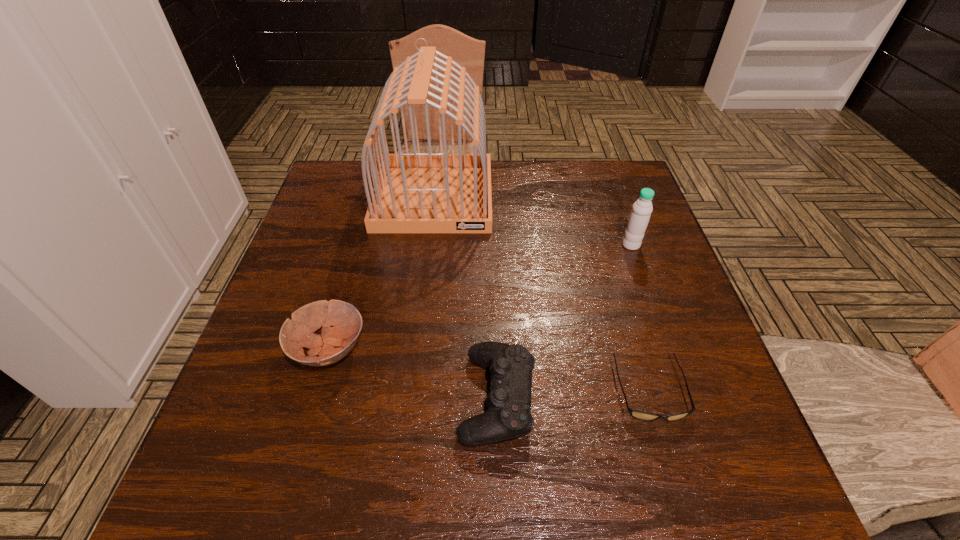
Locate an element on the screen. This screenshot has height=540, width=960. the tallest object is located at coordinates (414, 192).

The width and height of the screenshot is (960, 540). I want to click on birdcage, so click(414, 192).

What are the coordinates of `water bottle` in the screenshot? It's located at (639, 217).

Locate an element on the screen. the fourth shortest object is located at coordinates (639, 217).

You are a GUI agent. You are given a task and a screenshot of the screen. Output one action in this format:
    pyautogui.click(x=<x>, y=<y>)
    Task: Click on the control
    
    Given the screenshot: What is the action you would take?
    pyautogui.click(x=508, y=416)

At what (x,y) coordinates should I click in order to perform the action: click on bowl. Please return your answer as a coordinate pair (x, y). This screenshot has width=960, height=540. Looking at the image, I should click on (334, 343).

The height and width of the screenshot is (540, 960). In order to click on sunglasses in this screenshot , I will do `click(641, 415)`.

Image resolution: width=960 pixels, height=540 pixels. I want to click on free spot located 0.210m with an open door on the birdcage, so click(x=422, y=294).

Where is `vacant space located on the front of the fourth shortest object`? This screenshot has height=540, width=960. vacant space located on the front of the fourth shortest object is located at coordinates (644, 284).

This screenshot has width=960, height=540. I want to click on vacant space positioned 0.360m on the left of the control, so click(x=264, y=397).